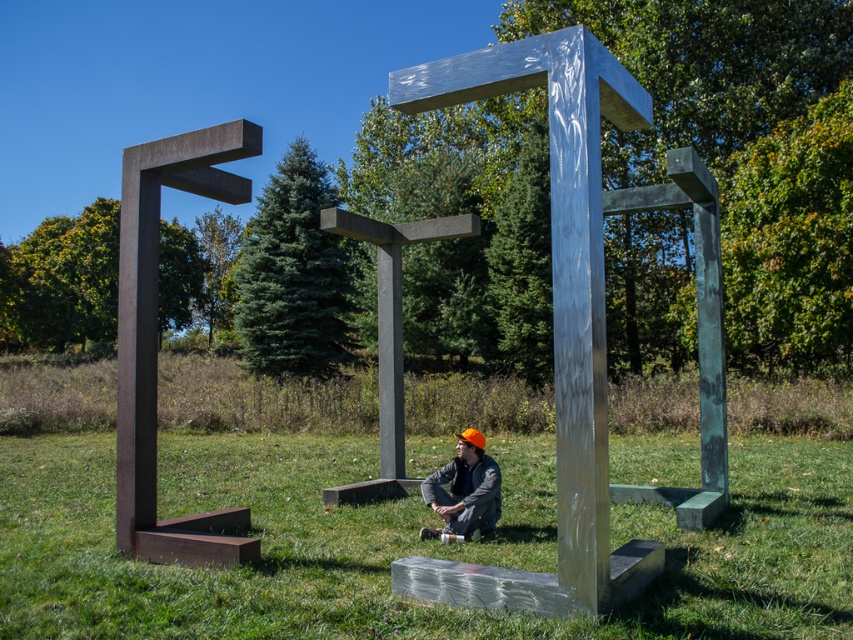
Question: In this image, where is green grass at center located relative to matte orange helmet at center?

Choices:
 (A) right
 (B) left

Answer: (A)

Question: Which object appears closest to the camera in this image?

Choices:
 (A) matte orange helmet at center
 (B) green grass at center

Answer: (B)

Question: Does green grass at center have a greater width compared to matte orange helmet at center?

Choices:
 (A) yes
 (B) no

Answer: (A)

Question: Which of the following is the closest to the observer?

Choices:
 (A) matte orange helmet at center
 (B) green grass at center

Answer: (B)

Question: Which point is closer to the camera?

Choices:
 (A) (200, 616)
 (B) (479, 468)

Answer: (A)

Question: Observing the image, what is the correct spatial positioning of green grass at center in reference to matte orange helmet at center?

Choices:
 (A) left
 (B) right

Answer: (B)